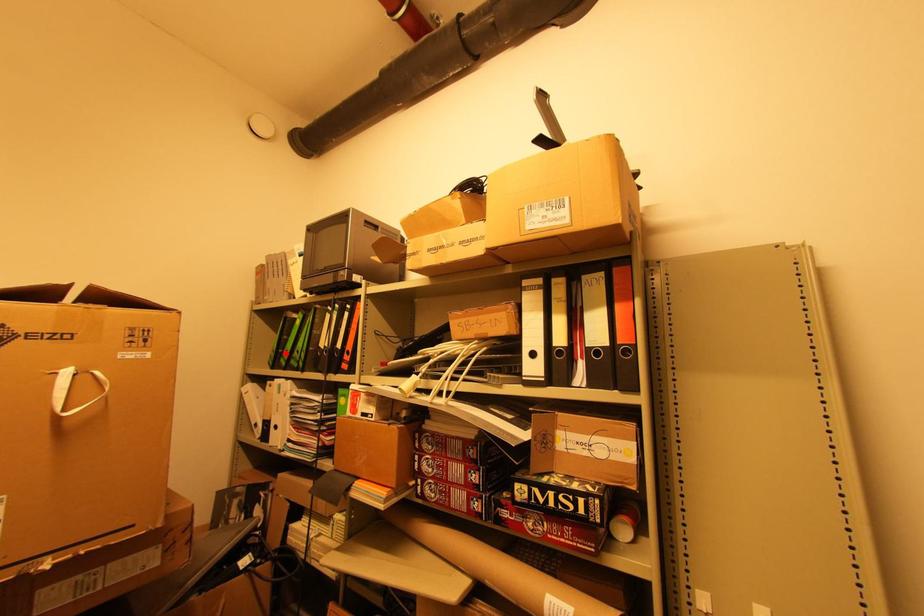
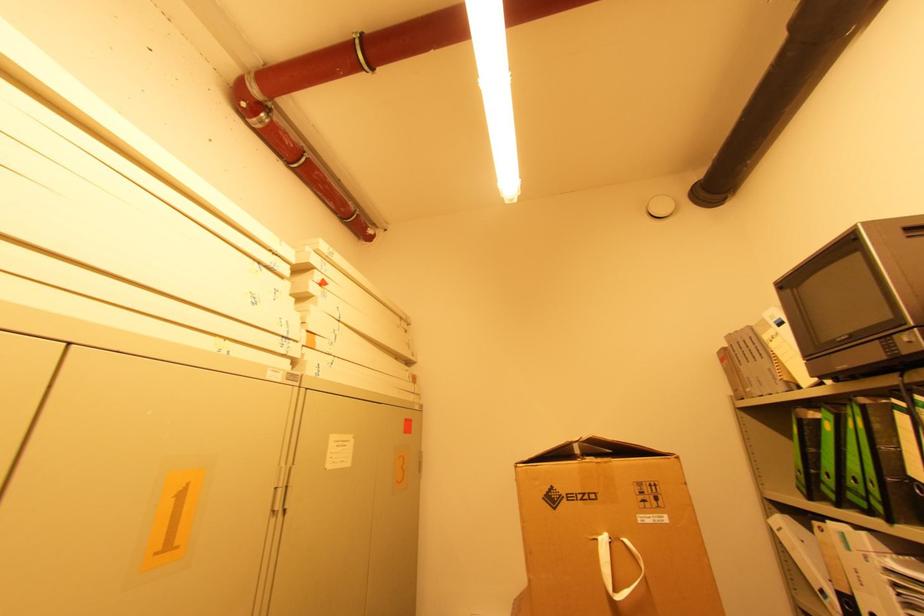
The point at the highlighted location is marked in the first image. Where is the corresponding point in the second image?

(822, 476)